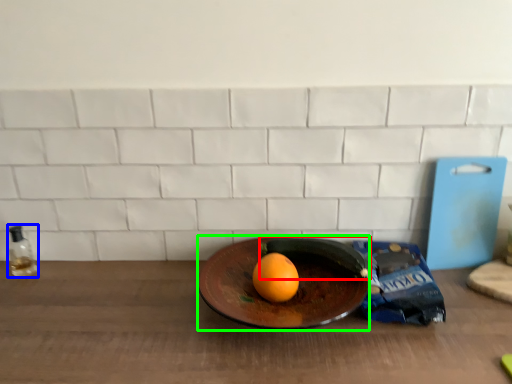
Question: Considering the real-world distances, which object is closest to banana (highlighted by a red box)? bottle (highlighted by a blue box) or plate (highlighted by a green box).

Choices:
 (A) bottle
 (B) plate

Answer: (B)